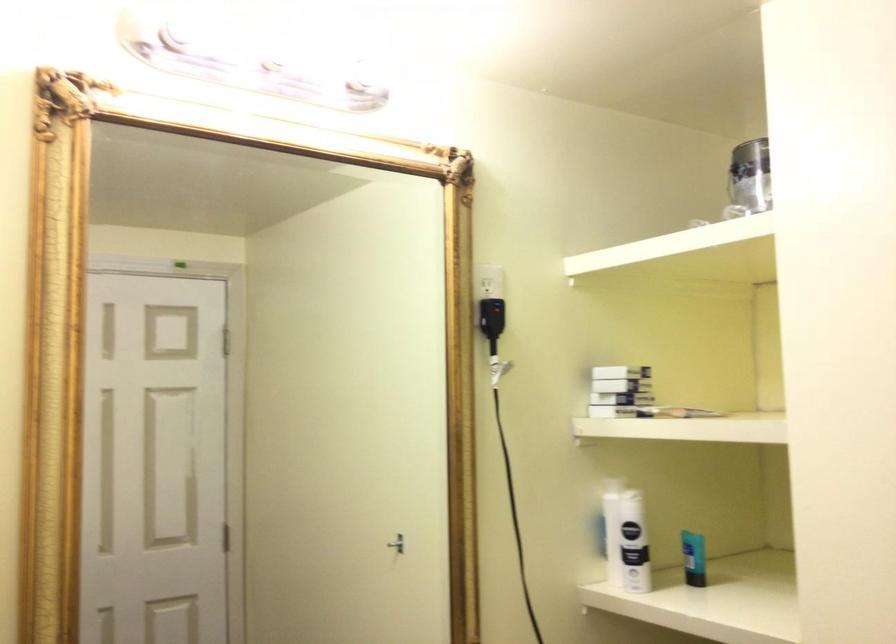
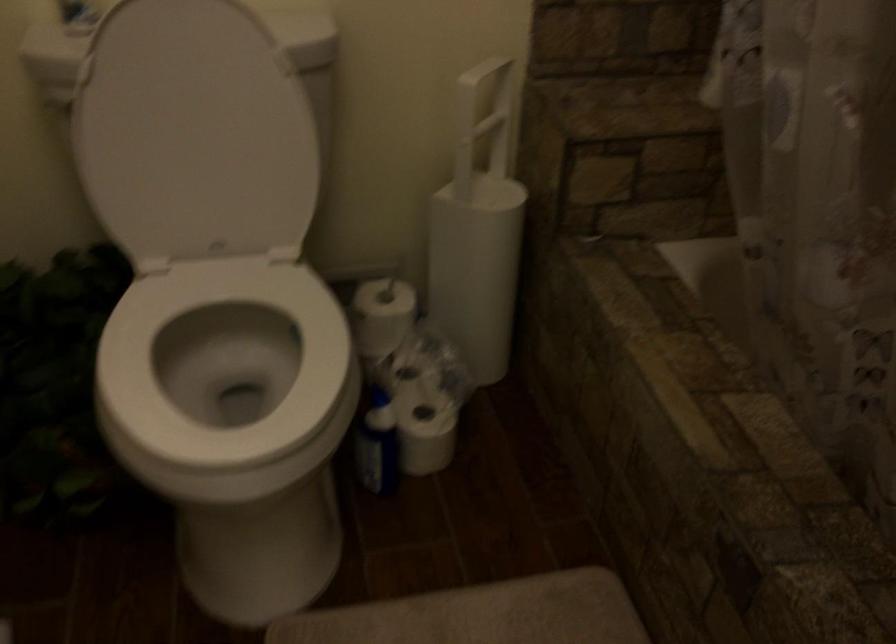
First-person continuous shooting, in which direction is the camera rotating?

The rotation direction of the camera is left-down.